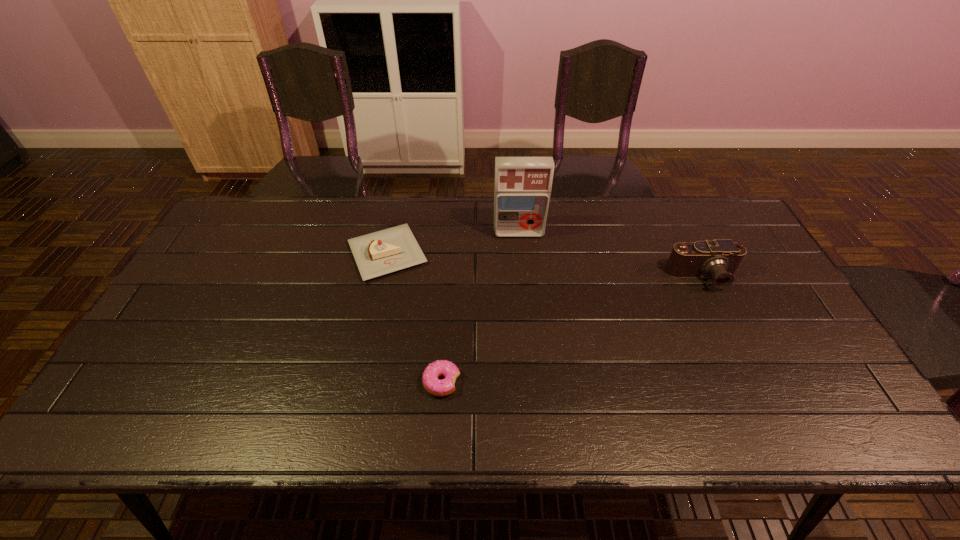
Find the location of `free space between the third object from right to left and the cake`. free space between the third object from right to left and the cake is located at coordinates (415, 318).

This screenshot has width=960, height=540. In order to click on vacant point located between the doughnut and the rightmost object in this screenshot , I will do `click(572, 330)`.

Locate an element on the screen. Image resolution: width=960 pixels, height=540 pixels. free space between the third object from left to right and the second object from left to right is located at coordinates (480, 307).

This screenshot has height=540, width=960. I want to click on empty location between the second object from right to left and the second tallest object, so click(611, 255).

Image resolution: width=960 pixels, height=540 pixels. Identify the location of free space between the third shortest object and the second object from left to right. (572, 330).

The width and height of the screenshot is (960, 540). I want to click on vacant space that's between the third tallest object and the nearest object, so click(x=415, y=318).

Locate an element on the screen. free space between the second object from right to left and the leftmost object is located at coordinates (453, 243).

The width and height of the screenshot is (960, 540). In order to click on free point between the third tallest object and the rightmost object in this screenshot , I will do pyautogui.click(x=545, y=266).

Image resolution: width=960 pixels, height=540 pixels. Identify the location of free space between the second tallest object and the shortest object. (572, 330).

The image size is (960, 540). Find the location of `vacant area that lies between the rightmost object and the first-aid kit`. vacant area that lies between the rightmost object and the first-aid kit is located at coordinates point(611,255).